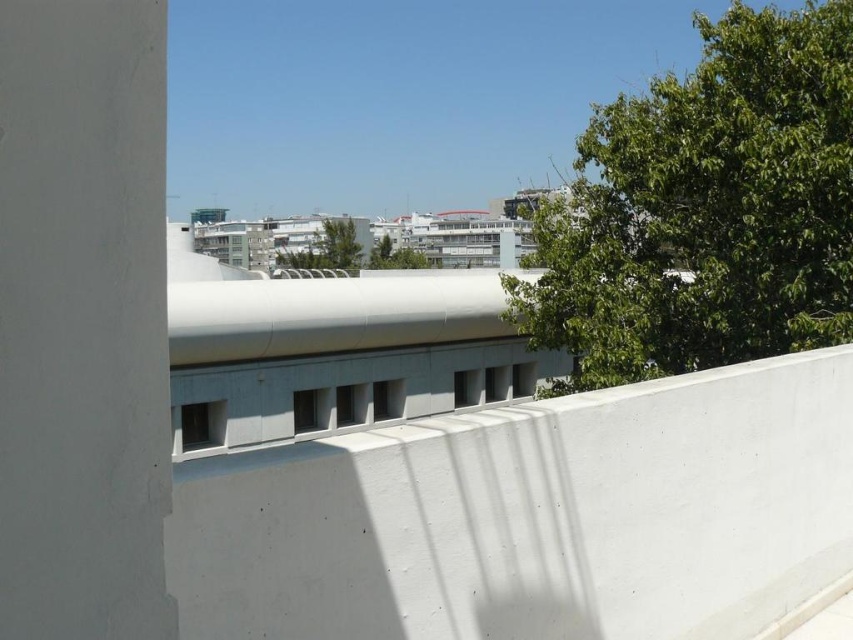
Question: Is green leafy tree at upper right below green leafy tree at center?

Choices:
 (A) yes
 (B) no

Answer: (B)

Question: Among these points, which one is farthest from the camera?

Choices:
 (A) (338, 236)
 (B) (786, 32)

Answer: (A)

Question: Which point is closer to the camera?

Choices:
 (A) green leafy tree at center
 (B) green leafy tree at upper right

Answer: (B)

Question: Which of the following is the closest to the observer?

Choices:
 (A) green leafy tree at upper right
 (B) green leafy tree at center

Answer: (A)

Question: Is green leafy tree at upper right above green leafy tree at center?

Choices:
 (A) no
 (B) yes

Answer: (B)

Question: From the image, what is the correct spatial relationship of green leafy tree at upper right in relation to green leafy tree at center?

Choices:
 (A) left
 (B) right

Answer: (B)